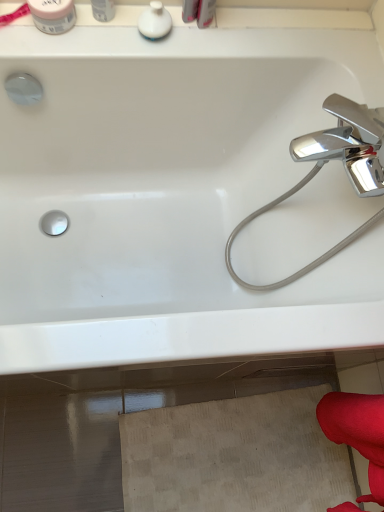
I want to click on vacant point to the right of white glossy soap dispenser at upper center, which ranks as the first toiletry in right-to-left order, so click(218, 40).